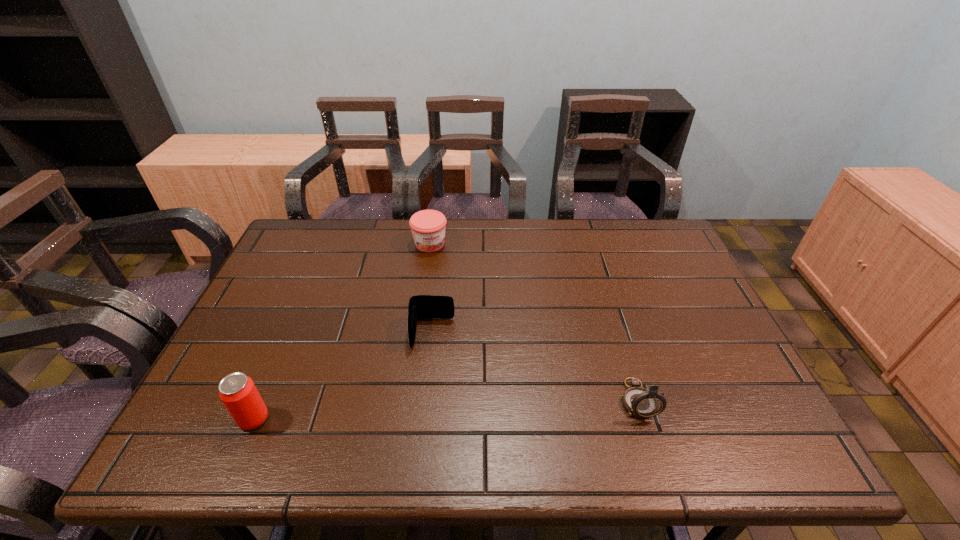
The image size is (960, 540). I want to click on vacant area that lies between the beer can and the second farthest object, so click(343, 376).

The height and width of the screenshot is (540, 960). In order to click on blank region between the jam and the compass in this screenshot , I will do `click(534, 321)`.

Image resolution: width=960 pixels, height=540 pixels. In order to click on object that is the second nearest to the beer can in this screenshot , I will do `click(428, 227)`.

At what (x,y) coordinates should I click in order to perform the action: click on object that stands as the closest to the shortest object. Please return your answer as a coordinate pair (x, y). Looking at the image, I should click on (428, 227).

Find the location of a particular element. The width and height of the screenshot is (960, 540). vacant area that satisfies the following two spatial constraints: 1. on the front side of the shortest object; 2. on the right side of the farthest object is located at coordinates (417, 333).